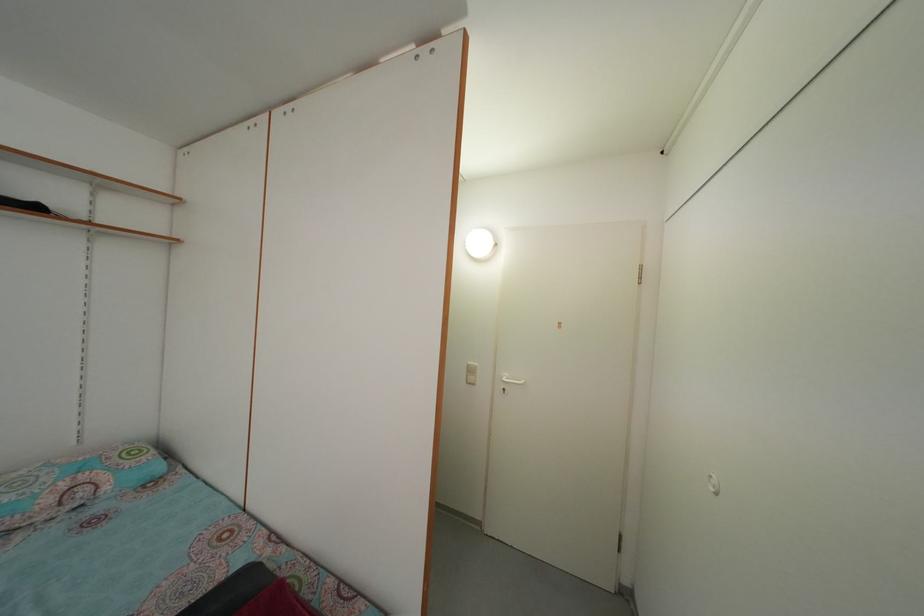
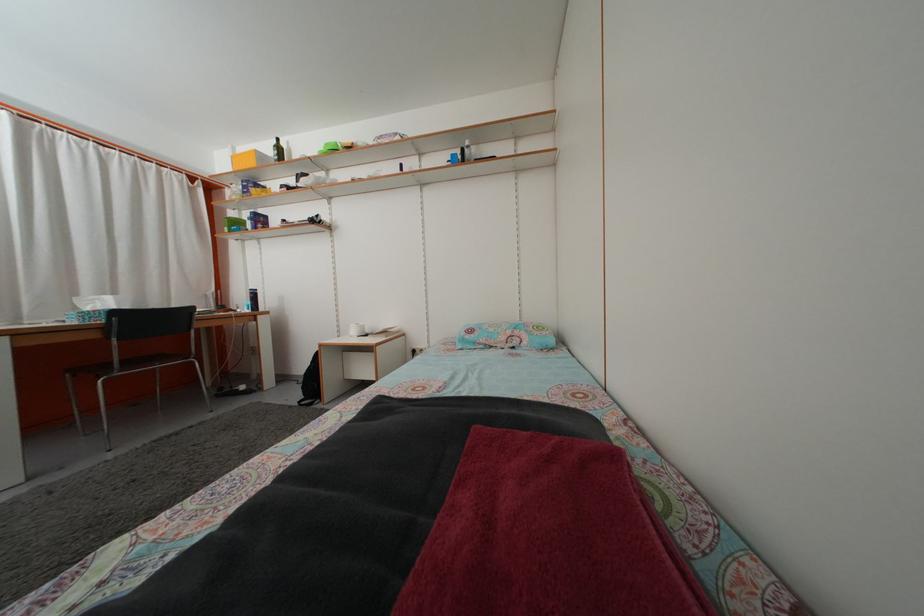
The point at (56,507) is marked in the first image. Where is the corresponding point in the second image?

(508, 346)